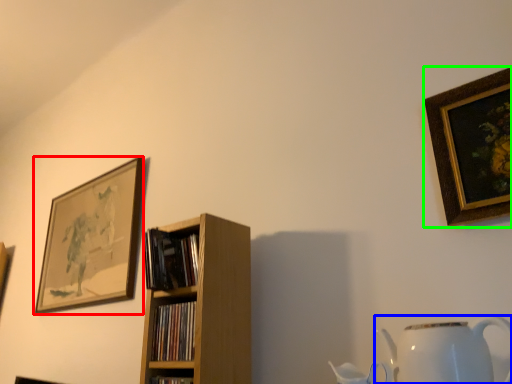
Question: Which is nearer to the picture frame (highlighted by a red box)? jug (highlighted by a blue box) or picture frame (highlighted by a green box).

Choices:
 (A) jug
 (B) picture frame

Answer: (A)